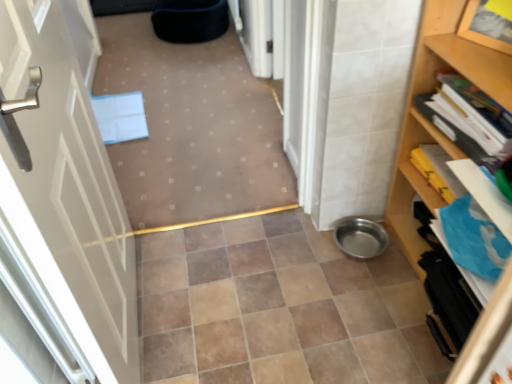
At what (x,y) coordinates should I click in order to perform the action: click on empty space that is ontop of brown ceramic tile at center (from a real-world perspective). Please return your answer as a coordinate pair (x, y). The image size is (512, 384). Looking at the image, I should click on (245, 322).